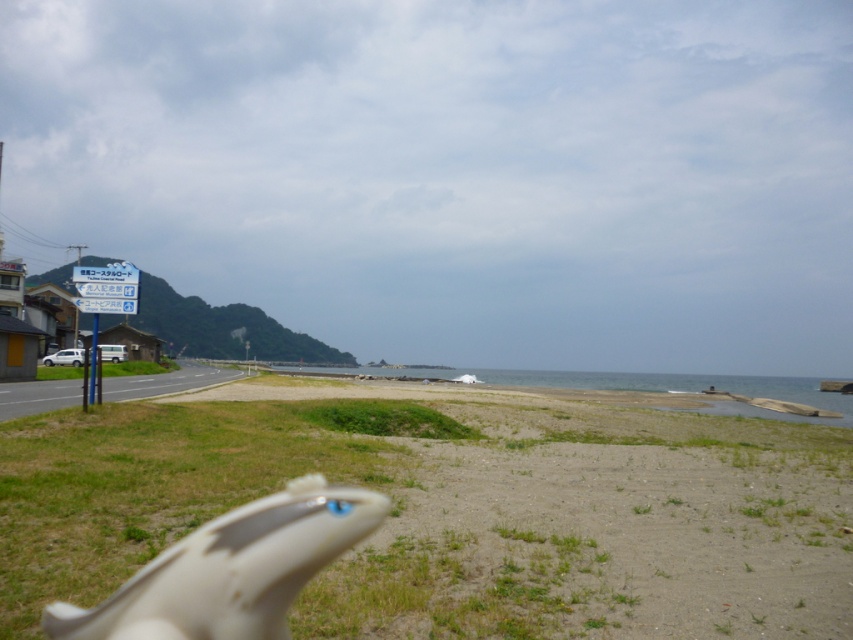
You are standing at the point with coordinates point (129, 273) and want to walk towards the point with coordinates point (393, 512). According to the scene description, will you pass through the sandy area with patches of grass before reaching your destination?

Yes, because point (393, 512) is in front of point (129, 273), meaning the path from point (129, 273) to point (393, 512) would cross the sandy area with patches of grass first as described in the scene.

You are a photographer planning to capture the entire scene in one shot. Given that the gravelly sand beach at lower center and the blue plastic sign at upper left are both in the frame, which object would occupy more space in the photo?

The gravelly sand beach at lower center occupies more space in the photo than the blue plastic sign at upper left because it is bigger according to the description.